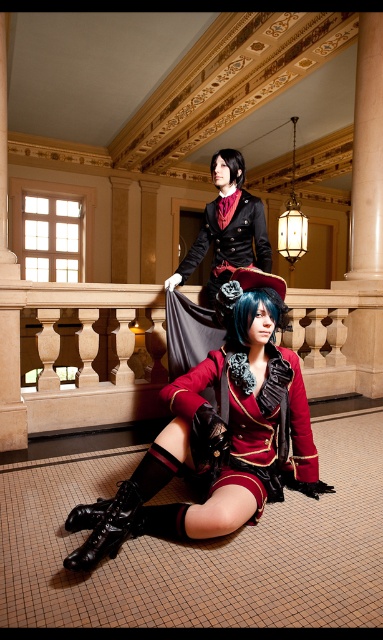
Can you confirm if matte black coat at upper center is positioned to the right of black matte hair at upper center?

Correct, you'll find matte black coat at upper center to the right of black matte hair at upper center.

Who is positioned more to the right, matte black coat at upper center or black matte hair at upper center?

matte black coat at upper center

Which is in front, point (186, 257) or point (234, 154)?

Positioned in front is point (234, 154).

Where is `matte black coat at upper center`? matte black coat at upper center is located at coordinates (230, 243).

Can you confirm if matte black coat at upper center is thinner than blue matte hair at center?

No.

Who is taller, matte black coat at upper center or blue matte hair at center?

matte black coat at upper center is taller.

Is point (250, 244) farther from camera compared to point (220, 292)?

Yes, point (250, 244) is behind point (220, 292).

Locate an element on the screen. matte black coat at upper center is located at coordinates (230, 243).

Is matte black coat at upper center closer to camera compared to black leather boot at lower left?

No, it is not.

Which is behind, point (212, 224) or point (98, 548)?

The point (212, 224) is behind.

Image resolution: width=383 pixels, height=640 pixels. What do you see at coordinates (230, 243) in the screenshot?
I see `matte black coat at upper center` at bounding box center [230, 243].

Locate an element on the screen. The width and height of the screenshot is (383, 640). matte black coat at upper center is located at coordinates [230, 243].